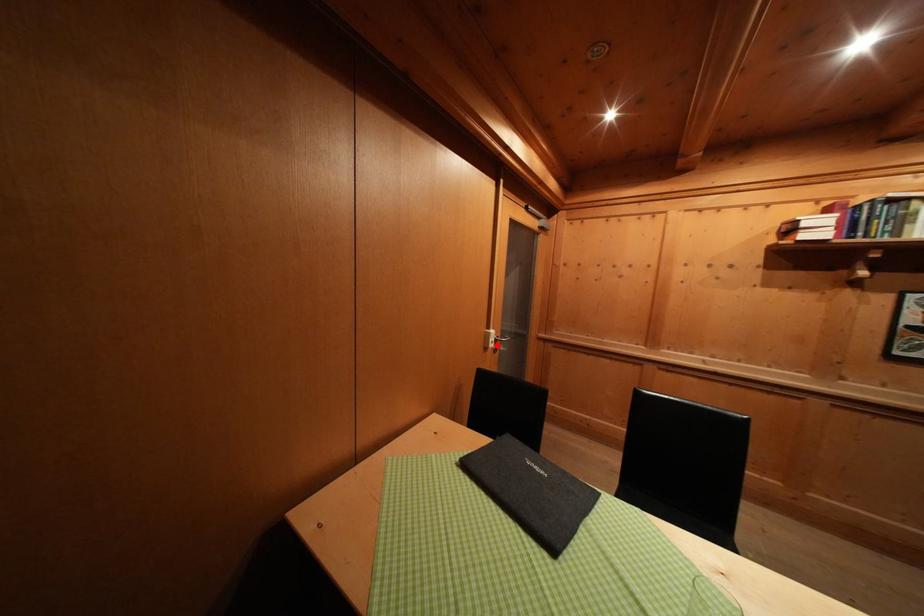
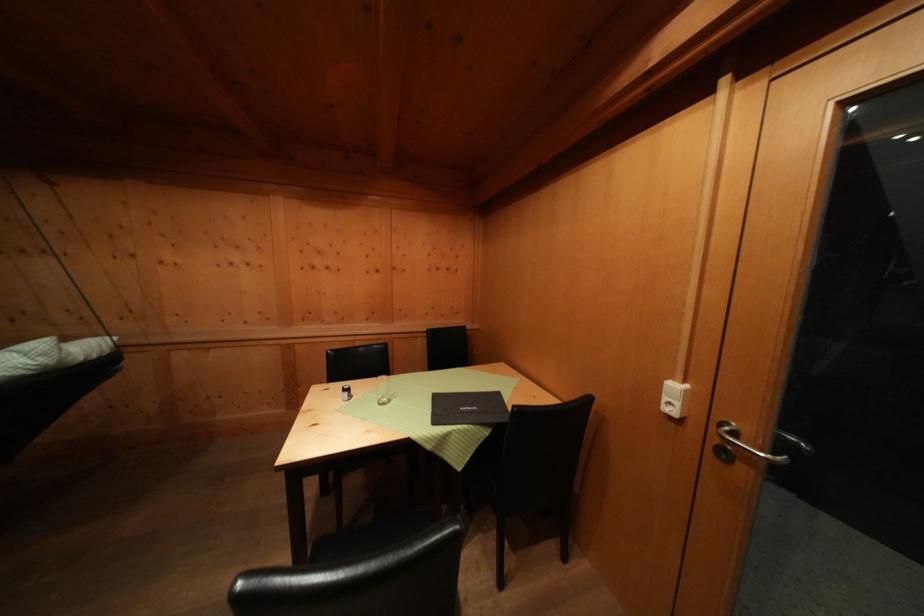
Locate, in the second image, the point that corresponds to the highlighted location in the first image.

(672, 403)